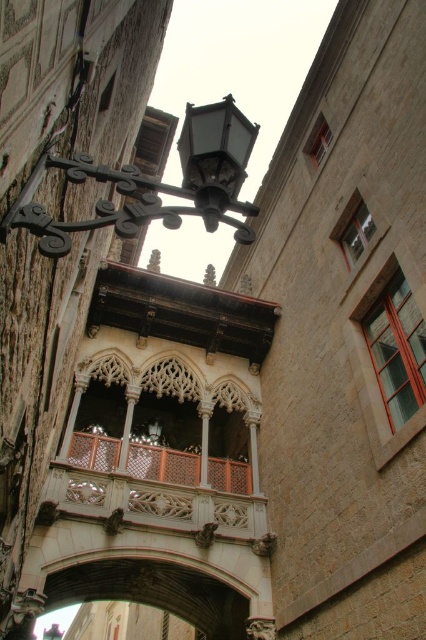
You are an architect inspecting the historic building. You notice the matte black lantern at upper left and the carved wood balcony at center. Which object is located above the other?

The matte black lantern at upper left is positioned over the carved wood balcony at center, meaning it is located above the balcony.

You are an architect designing a restoration project for this historic building. You need to replace the existing lanterns with new ones. The supplier offers two sizes of lanterns. Which lantern among the matte black lantern at upper left and the matte black lantern at upper center requires a larger base to support its weight?

The matte black lantern at upper left requires a larger base because it has a larger size compared to the matte black lantern at upper center, as stated in the description.

You are an architect inspecting the building. You need to determine if the carved wood balcony at center can support the weight of the matte black lantern at upper center. Based on their heights, can you conclude anything about their weight capacity?

The carved wood balcony at center is not as tall as the matte black lantern at upper center, but height does not directly indicate weight capacity. Further structural analysis is needed.